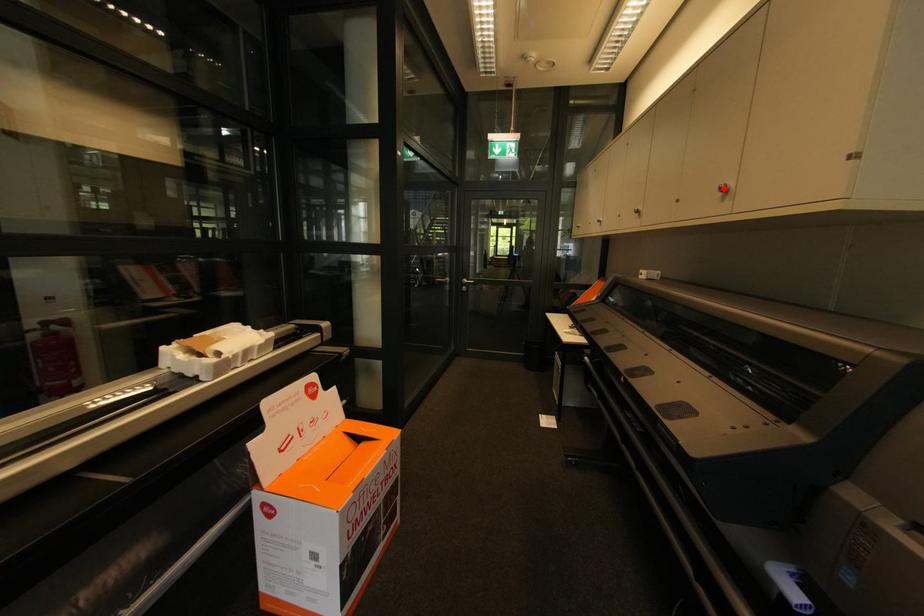
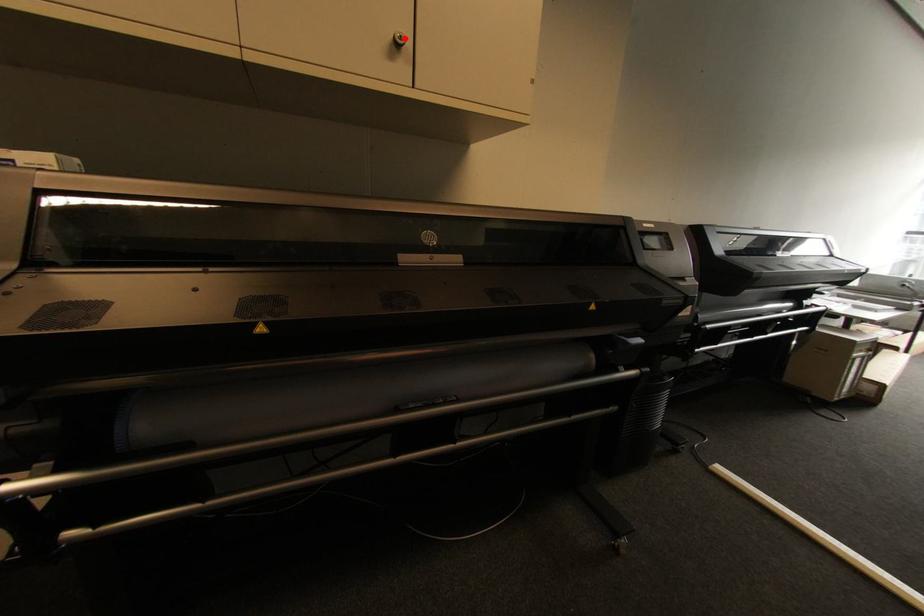
I am providing you with two images of the same scene from different viewpoints. A red point is marked on the first image and another point is marked on the second image. Does the point marked in image1 correspond to the same location as the one in image2?

Yes